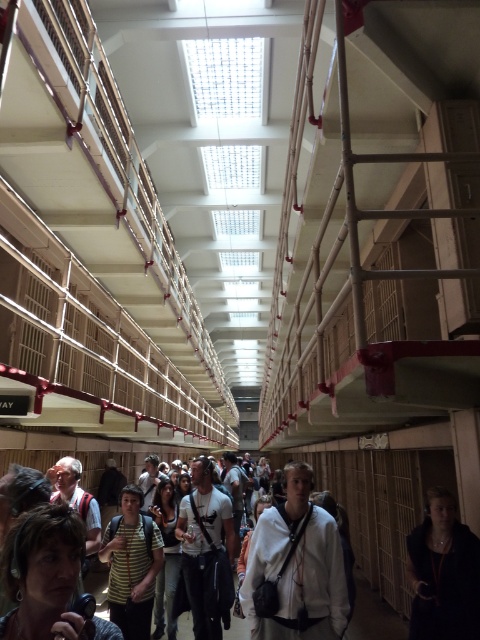
Question: Which point is farther to the camera?

Choices:
 (A) (436, 515)
 (B) (28, 588)
 (C) (228, 540)

Answer: (C)

Question: Is matte black headphones at lower left smaller than striped shirt at center?

Choices:
 (A) no
 (B) yes

Answer: (B)

Question: Does dark blue jacket at center appear under striped shirt at center?

Choices:
 (A) yes
 (B) no

Answer: (B)

Question: Can you confirm if white matte jacket at center is positioned to the left of matte black headphones at lower left?

Choices:
 (A) no
 (B) yes

Answer: (A)

Question: Which of the following is the closest to the observer?

Choices:
 (A) (308, 490)
 (B) (136, 582)
 (C) (199, 468)
 (D) (444, 589)

Answer: (A)

Question: Which point is closer to the camera?

Choices:
 (A) white matte jacket at center
 (B) dark blue jacket at center

Answer: (A)